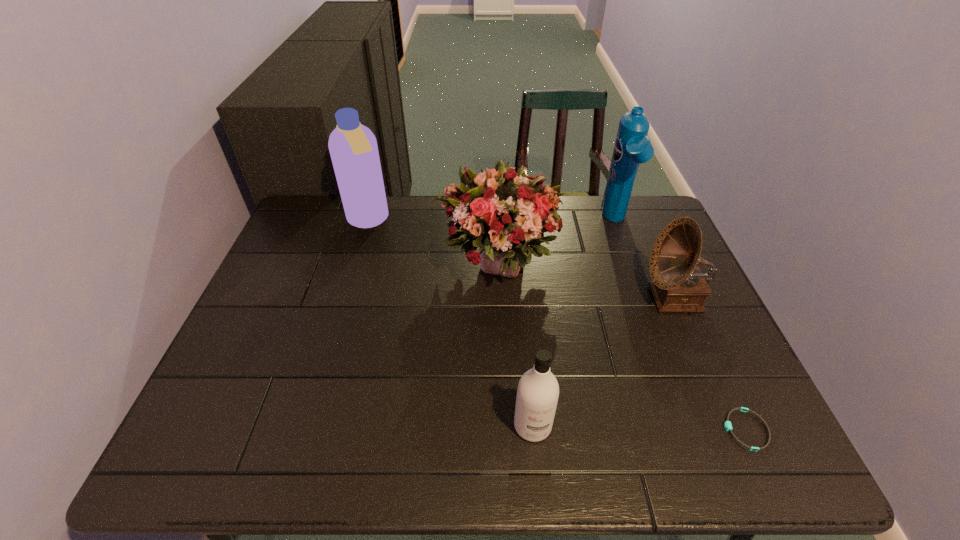
Identify the location of vacant space located 0.340m on the horn of the phonograph record. This screenshot has height=540, width=960. (517, 299).

Where is `blank space located 0.210m on the horn of the phonograph record`? blank space located 0.210m on the horn of the phonograph record is located at coordinates (566, 299).

Identify the location of blank area located 0.150m on the horn of the phonograph record. Image resolution: width=960 pixels, height=540 pixels. (588, 299).

Where is `free location located on the buckle of the shortest object`? The image size is (960, 540). free location located on the buckle of the shortest object is located at coordinates pyautogui.click(x=685, y=430).

Identify the location of vacant point located 0.290m on the buckle of the shortest object. (585, 430).

I want to click on free region located 0.400m on the buckle of the shortest object, so click(x=532, y=430).

At what (x,y) coordinates should I click in order to perform the action: click on bouquet that is at the far edge. Please return your answer as a coordinate pair (x, y). The image size is (960, 540). Looking at the image, I should click on (505, 213).

Image resolution: width=960 pixels, height=540 pixels. I want to click on shampoo at the near edge, so click(537, 394).

Locate an element on the screen. This screenshot has width=960, height=540. wristband positioned at the near edge is located at coordinates (727, 425).

This screenshot has width=960, height=540. I want to click on shampoo positioned at the right edge, so coord(632,147).